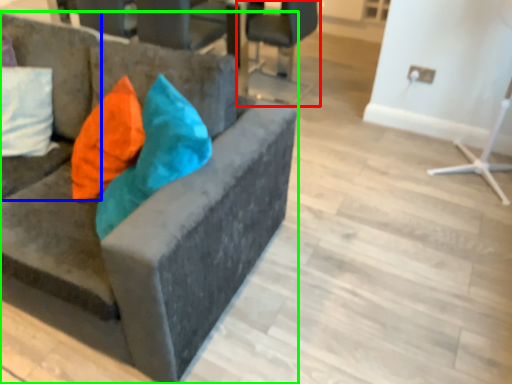
Question: Estimate the real-world distances between objects in this image. Which object is farther from chair (highlighted by a red box), studio couch (highlighted by a blue box) or chair (highlighted by a green box)?

Choices:
 (A) studio couch
 (B) chair

Answer: (B)